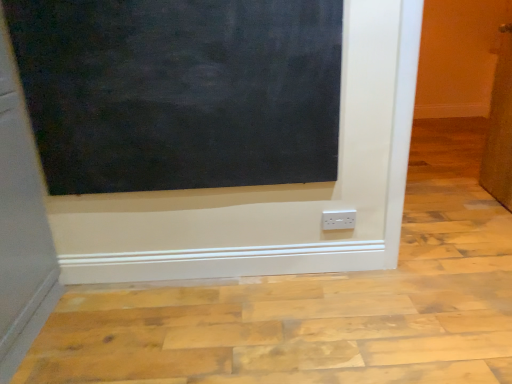
In order to click on free space to the left of brown textured door at right in this screenshot , I will do `click(442, 206)`.